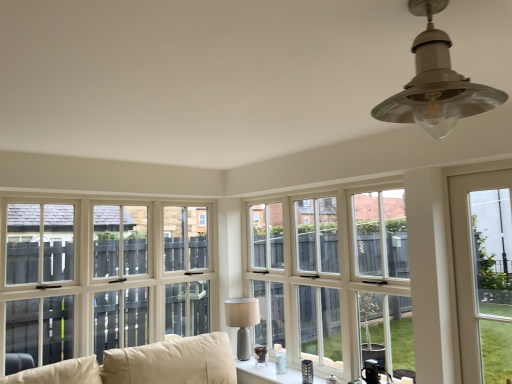
Question: Is point (482, 190) positioned closer to the camera than point (421, 94)?

Choices:
 (A) farther
 (B) closer

Answer: (A)

Question: From the image's perspective, is clear glass door at right, the 1th window viewed from the right, located above or below satin silver lampshade at upper center, which is the second lamp from back to front?

Choices:
 (A) below
 (B) above

Answer: (A)

Question: Which object is positioned closest to the beige fabric couch at lower left?

Choices:
 (A) matte gray lamp at center, acting as the first lamp starting from the bottom
 (B) white wood window at center, which appears as the second window when viewed from the right
 (C) clear glass door at right, arranged as the 3th window when viewed from the left
 (D) satin silver lampshade at upper center, which is the second lamp from back to front
 (E) white glossy windowsill at center, marked as the third window in a right-to-left arrangement

Answer: (A)

Question: Which of these objects is positioned farthest from the clear glass door at right, the 1th window viewed from the right?

Choices:
 (A) matte gray lamp at center, the 2th lamp in the right-to-left sequence
 (B) white glossy windowsill at center, placed as the first window when sorted from left to right
 (C) satin silver lampshade at upper center, placed as the first lamp when sorted from top to bottom
 (D) white wood window at center, which appears as the second window when viewed from the right
 (E) beige fabric couch at lower left

Answer: (E)